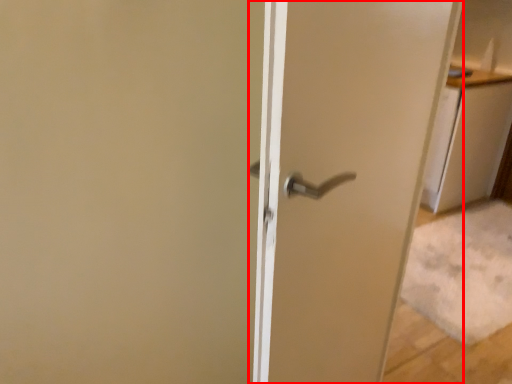
Question: From the image's perspective, what is the correct spatial relationship of door (annotated by the red box) in relation to cabinetry?

Choices:
 (A) below
 (B) above

Answer: (A)